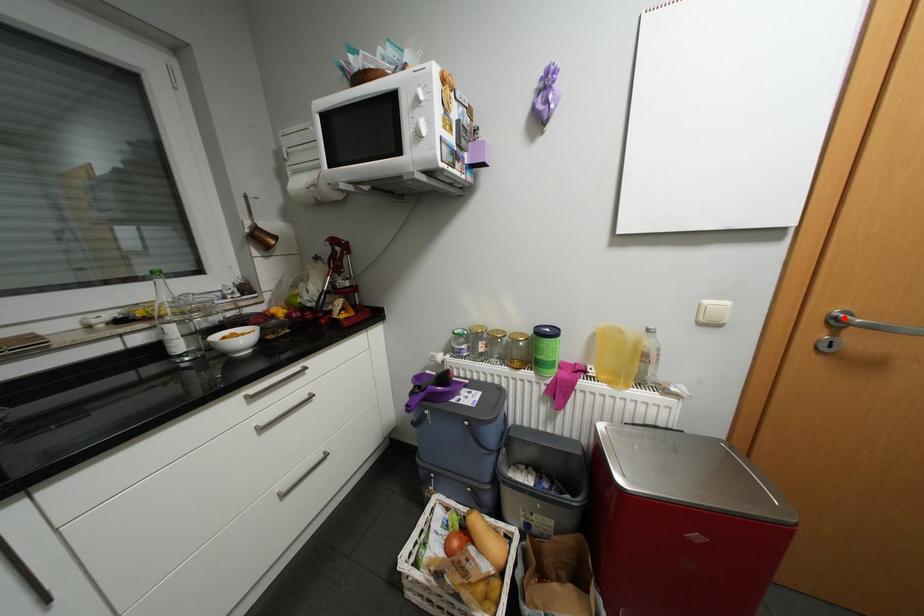
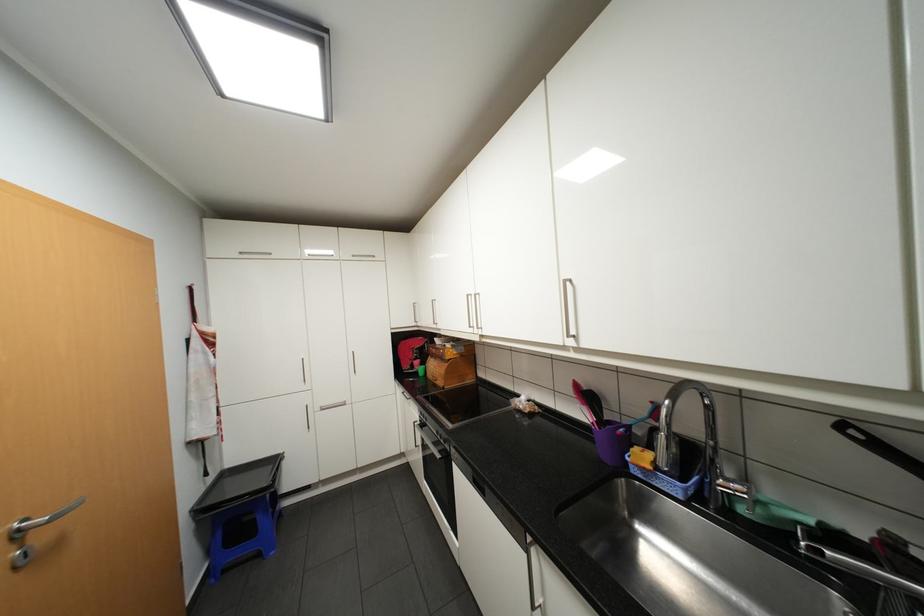
Question: I am providing you with two images of the same scene from different viewpoints. A red point is marked on the first image. Is the red point's position out of view in image 2?

Choices:
 (A) Yes
 (B) No

Answer: (B)